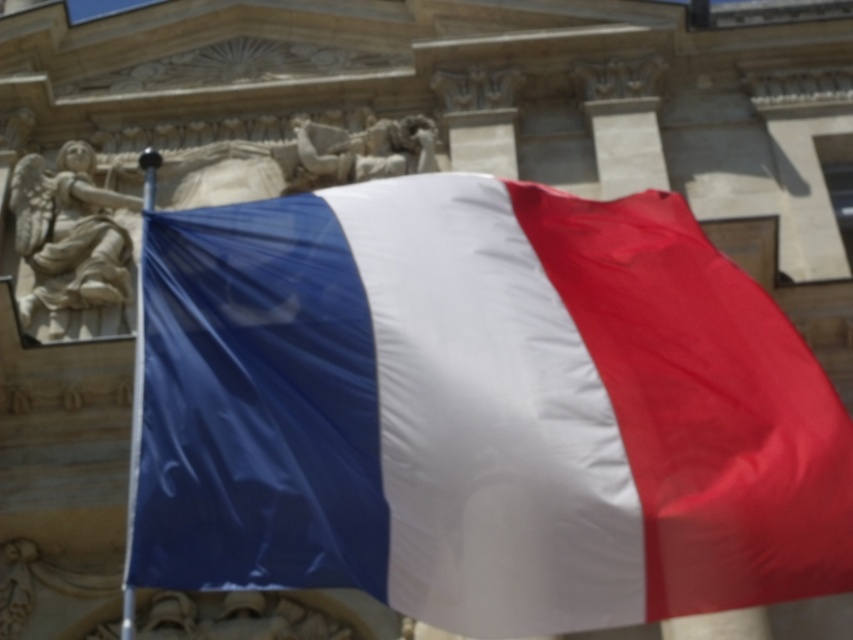
Is silky fabric flag at center behind white stone angel at upper left?

That is False.

Can you confirm if silky fabric flag at center is positioned above white stone angel at upper left?

No, silky fabric flag at center is not above white stone angel at upper left.

Is point (231, 323) positioned in front of point (123, 282)?

Yes, point (231, 323) is in front of point (123, 282).

The image size is (853, 640). I want to click on silky fabric flag at center, so click(x=480, y=410).

Who is taller, silky fabric flag at center or polished stone figures at center?

silky fabric flag at center is taller.

In the scene shown: Who is more distant from viewer, (209, 433) or (315, 131)?

The point (315, 131) is behind.

Between point (810, 500) and point (374, 156), which one is positioned in front?

Point (810, 500) is in front.

In order to click on silky fabric flag at center in this screenshot , I will do `click(480, 410)`.

Which is below, white stone angel at upper left or polished stone figures at center?

Positioned lower is white stone angel at upper left.

Which is behind, point (117, 321) or point (393, 145)?

Point (393, 145)

Locate an element on the screen. This screenshot has width=853, height=640. white stone angel at upper left is located at coordinates (70, 240).